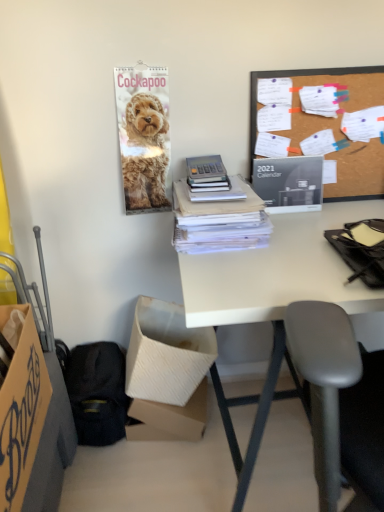
The height and width of the screenshot is (512, 384). I want to click on free point in front of white paper at center, so click(249, 272).